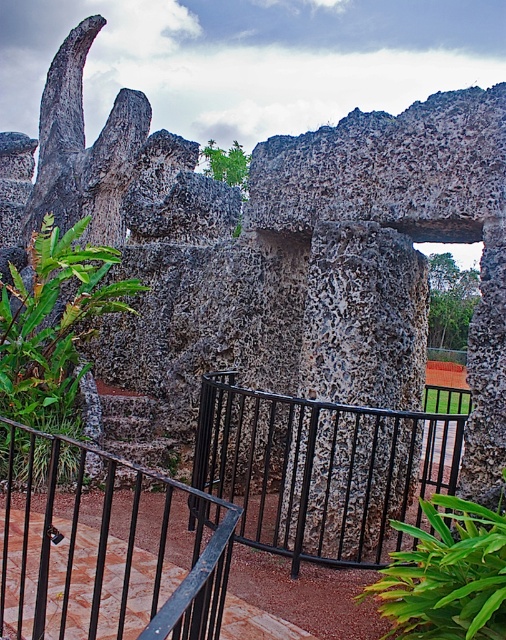
You are standing at the point marked as point (106, 545) in the image. What object are you currently standing on?

You are standing on the black metal railing at center.

You are standing at the base of the stone structure and want to determine which of the two points, point (35, 452) or point (107, 442), is closer to you. Based on the coordinates provided, which point is nearer?

Point (35, 452) is closer to the viewer than point (107, 442).